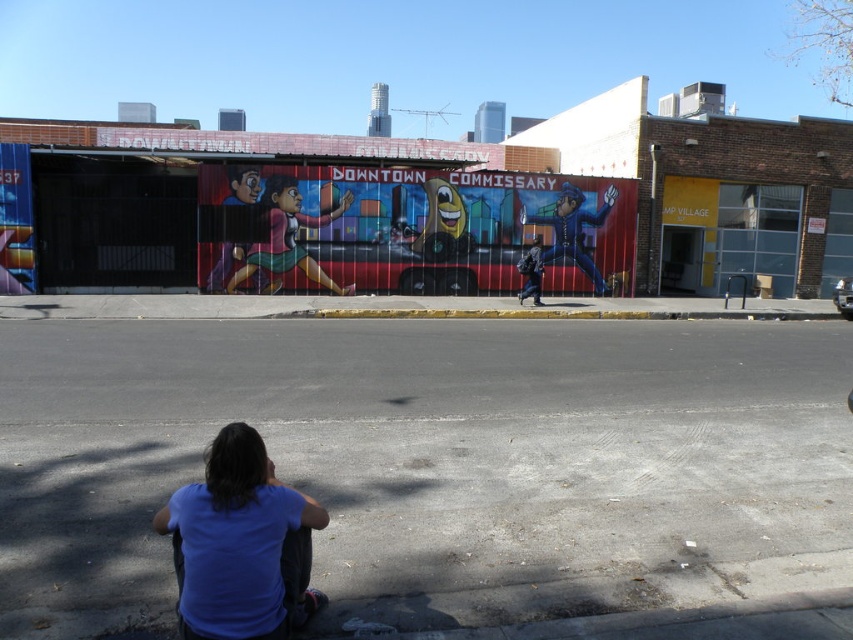
Question: Is gray asphalt at lower center to the left of blue uniform at center from the viewer's perspective?

Choices:
 (A) yes
 (B) no

Answer: (A)

Question: Considering the real-world distances, which object is closest to the blue cotton shirt at lower center?

Choices:
 (A) blue uniform at center
 (B) gray asphalt at lower center

Answer: (B)

Question: Where is blue cotton shirt at lower center located in relation to blue uniform at center in the image?

Choices:
 (A) left
 (B) right

Answer: (A)

Question: Which of the following is the farthest from the observer?

Choices:
 (A) (247, 544)
 (B) (718, 371)

Answer: (B)

Question: Based on their relative distances, which object is farther from the gray asphalt at lower center?

Choices:
 (A) blue uniform at center
 (B) blue cotton shirt at lower center

Answer: (A)

Question: Does gray asphalt at lower center appear under blue uniform at center?

Choices:
 (A) no
 (B) yes

Answer: (B)